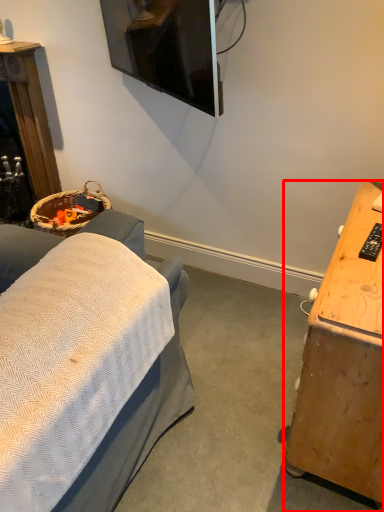
Question: In this image, where is desk (annotated by the red box) located relative to furniture?

Choices:
 (A) right
 (B) left

Answer: (A)